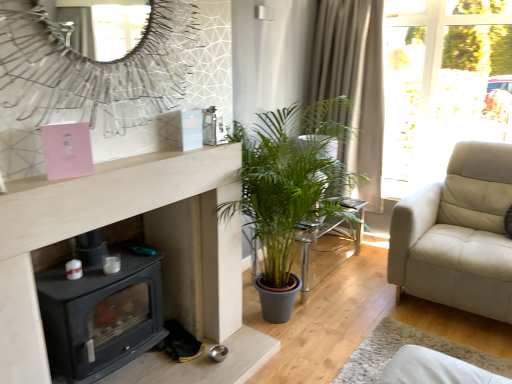
Question: Is translucent glass table at center far away from beige textured curtain at upper right?

Choices:
 (A) yes
 (B) no

Answer: (B)

Question: Considering the relative sizes of translucent glass table at center and beige textured curtain at upper right in the image provided, is translucent glass table at center wider than beige textured curtain at upper right?

Choices:
 (A) yes
 (B) no

Answer: (A)

Question: Can you confirm if translucent glass table at center is shorter than beige textured curtain at upper right?

Choices:
 (A) yes
 (B) no

Answer: (A)

Question: From the image's perspective, is translucent glass table at center on top of beige textured curtain at upper right?

Choices:
 (A) no
 (B) yes

Answer: (A)

Question: From the image's perspective, is translucent glass table at center below beige textured curtain at upper right?

Choices:
 (A) yes
 (B) no

Answer: (A)

Question: Could you tell me if translucent glass table at center is facing beige textured curtain at upper right?

Choices:
 (A) no
 (B) yes

Answer: (A)

Question: Is the position of metallic silver mirror at upper center more distant than that of translucent glass table at center?

Choices:
 (A) yes
 (B) no

Answer: (B)

Question: Is the surface of metallic silver mirror at upper center in direct contact with translucent glass table at center?

Choices:
 (A) yes
 (B) no

Answer: (B)

Question: Is metallic silver mirror at upper center smaller than translucent glass table at center?

Choices:
 (A) no
 (B) yes

Answer: (B)

Question: From the image's perspective, is metallic silver mirror at upper center above translucent glass table at center?

Choices:
 (A) yes
 (B) no

Answer: (A)

Question: From the image's perspective, is metallic silver mirror at upper center beneath translucent glass table at center?

Choices:
 (A) no
 (B) yes

Answer: (A)

Question: Considering the relative sizes of metallic silver mirror at upper center and translucent glass table at center in the image provided, is metallic silver mirror at upper center taller than translucent glass table at center?

Choices:
 (A) no
 (B) yes

Answer: (B)

Question: Considering the relative sizes of black matte wood burning stove at lower left and metallic silver mirror at upper center in the image provided, is black matte wood burning stove at lower left taller than metallic silver mirror at upper center?

Choices:
 (A) yes
 (B) no

Answer: (A)